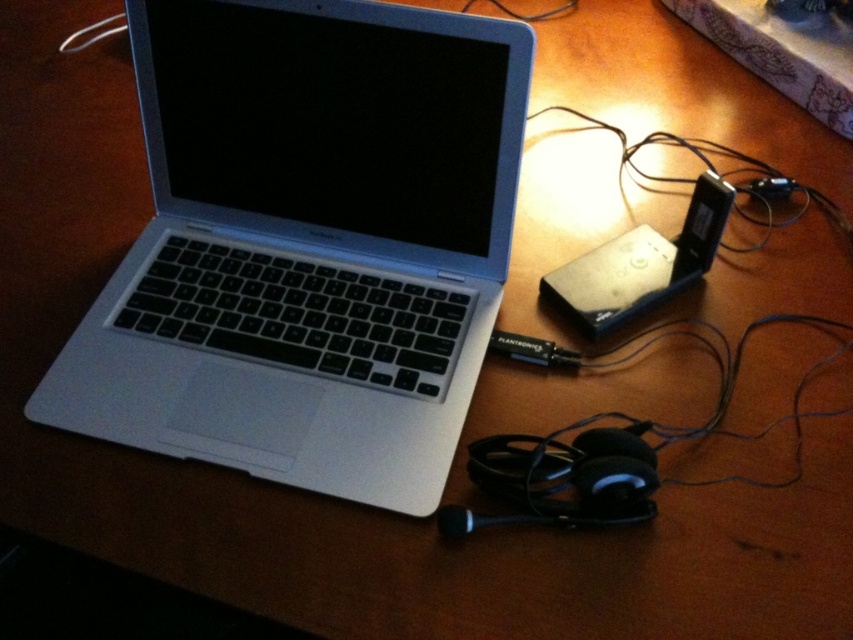
Question: Which point appears farthest from the camera in this image?

Choices:
 (A) (729, 195)
 (B) (440, 305)

Answer: (B)

Question: Estimate the real-world distances between objects in this image. Which object is closer to the black plastic ipod at center-right?

Choices:
 (A) silver metallic laptop at center
 (B) satin black ipod at center right

Answer: (B)

Question: Which point is farther from the camera taking this photo?

Choices:
 (A) (709, 186)
 (B) (611, 308)

Answer: (B)

Question: Is silver metallic laptop at center in front of satin black ipod at center right?

Choices:
 (A) yes
 (B) no

Answer: (A)

Question: Observing the image, what is the correct spatial positioning of silver metallic laptop at center in reference to black plastic ipod at center-right?

Choices:
 (A) right
 (B) left

Answer: (B)

Question: Is silver metallic laptop at center bigger than black plastic ipod at center-right?

Choices:
 (A) yes
 (B) no

Answer: (A)